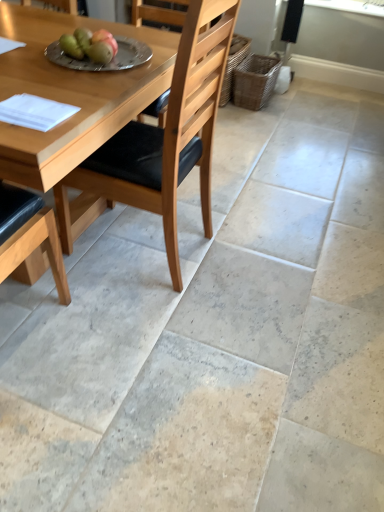
The width and height of the screenshot is (384, 512). Find the location of `vacant space situated on the left part of silver metallic plate at upper center`. vacant space situated on the left part of silver metallic plate at upper center is located at coordinates (31, 50).